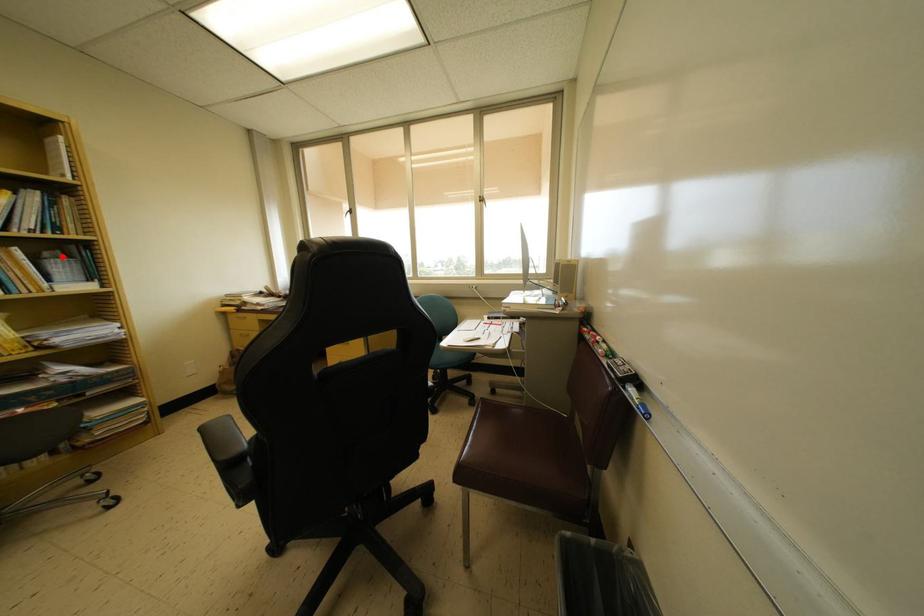
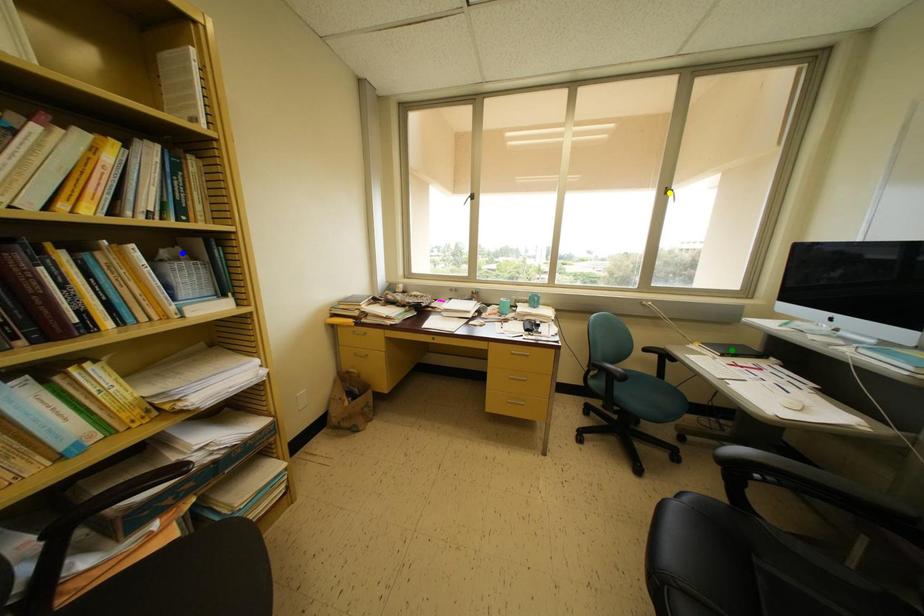
Question: I am providing you with two images of the same scene from different viewpoints. A red point is marked on the first image. You are given multiple points on the second image. Which spot in image 2 lines up with the point in image 1?

Choices:
 (A) yellow point
 (B) green point
 (C) blue point

Answer: (C)